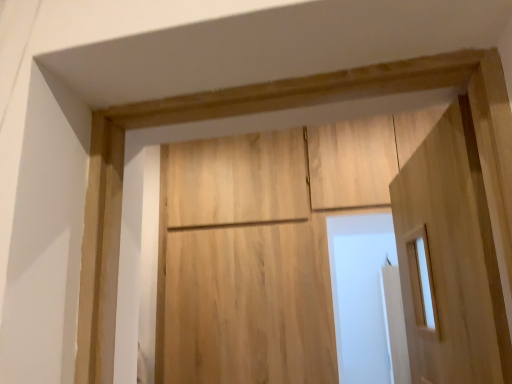
Locate an element on the screen. This screenshot has width=512, height=384. natural wood barn door at center is located at coordinates (245, 264).

Image resolution: width=512 pixels, height=384 pixels. What do you see at coordinates (245, 264) in the screenshot? I see `natural wood barn door at center` at bounding box center [245, 264].

In order to face natural wood barn door at center, should I rotate leftwards or rightwards?

You should rotate right by 5.518 degrees.

What is the approximate height of natural wood barn door at center?

natural wood barn door at center is 1.35 meters in height.

Where is `light wood door at right`? This screenshot has height=384, width=512. light wood door at right is located at coordinates (450, 259).

What do you see at coordinates (450, 259) in the screenshot?
I see `light wood door at right` at bounding box center [450, 259].

Measure the distance between light wood door at right and camera.

light wood door at right and camera are 27.71 inches apart from each other.

At what (x,y) coordinates should I click in order to perform the action: click on natural wood barn door at center. Please return your answer as a coordinate pair (x, y). Looking at the image, I should click on (245, 264).

Considering the relative positions of natural wood barn door at center and light wood door at right in the image provided, is natural wood barn door at center to the left or to the right of light wood door at right?

natural wood barn door at center is to the left of light wood door at right.

Which object is further away from the camera, natural wood barn door at center or light wood door at right?

natural wood barn door at center is further from the camera.

Between point (205, 323) and point (472, 245), which one is positioned in front?

The point (472, 245) is in front.

From the image's perspective, is natural wood barn door at center beneath light wood door at right?

Correct, natural wood barn door at center appears lower than light wood door at right in the image.

From a real-world perspective, is natural wood barn door at center physically located above or below light wood door at right?

From a real-world perspective, natural wood barn door at center is physically above light wood door at right.

Which of these two, natural wood barn door at center or light wood door at right, is wider?

With larger width is light wood door at right.

Which of these two, natural wood barn door at center or light wood door at right, stands taller?

natural wood barn door at center is taller.

Can you confirm if natural wood barn door at center is smaller than light wood door at right?

Incorrect, natural wood barn door at center is not smaller in size than light wood door at right.

Do you think natural wood barn door at center is within light wood door at right, or outside of it?

natural wood barn door at center is spatially situated outside light wood door at right.

Are natural wood barn door at center and light wood door at right located far from each other?

Yes.

Could you tell me if natural wood barn door at center is turned towards light wood door at right?

Yes, natural wood barn door at center is oriented towards light wood door at right.

How much distance is there between natural wood barn door at center and light wood door at right?

They are 1.07 meters apart.

You are a GUI agent. You are given a task and a screenshot of the screen. Output one action in this format:
    pyautogui.click(x=<x>, y=<y>)
    Task: Click on the door above the natural wood barn door at center (from the image's perspective)
    This screenshot has height=384, width=512.
    Given the screenshot: What is the action you would take?
    pyautogui.click(x=450, y=259)

Is light wood door at right to the right of natural wood barn door at center from the viewer's perspective?

Yes, light wood door at right is to the right of natural wood barn door at center.

Which is in front, light wood door at right or natural wood barn door at center?

Positioned in front is light wood door at right.

Considering the points (446, 157) and (172, 337), which point is in front, point (446, 157) or point (172, 337)?

The point (446, 157) is closer to the camera.

From the image's perspective, which object appears higher, light wood door at right or natural wood barn door at center?

light wood door at right appears higher in the image.

From a real-world perspective, is light wood door at right on natural wood barn door at center?

No.

Does light wood door at right have a lesser width compared to natural wood barn door at center?

Incorrect, the width of light wood door at right is not less than that of natural wood barn door at center.

Which of these two, light wood door at right or natural wood barn door at center, stands taller?

With more height is natural wood barn door at center.

Considering the sizes of objects light wood door at right and natural wood barn door at center in the image provided, who is smaller, light wood door at right or natural wood barn door at center?

Smaller between the two is light wood door at right.

Is natural wood barn door at center surrounded by light wood door at right?

Definitely not — natural wood barn door at center is not inside light wood door at right.

Based on the photo, is light wood door at right far away from natural wood barn door at center?

Yes, light wood door at right and natural wood barn door at center are located far from each other.

Could you tell me if light wood door at right is turned towards natural wood barn door at center?

No, light wood door at right is not aimed at natural wood barn door at center.

How distant is light wood door at right from natural wood barn door at center?

light wood door at right is 1.07 meters away from natural wood barn door at center.

This screenshot has height=384, width=512. In order to click on door in front of the natural wood barn door at center in this screenshot , I will do `click(450, 259)`.

Identify the location of barn door behind the light wood door at right. (245, 264).

What are the coordinates of `door located in front of the natural wood barn door at center` in the screenshot? It's located at (450, 259).